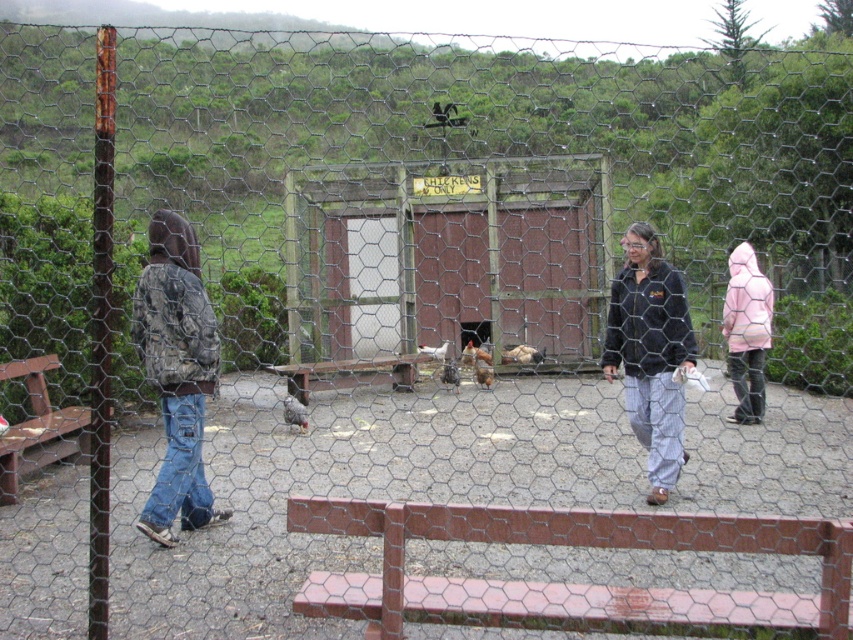
You are a farmer checking the chickens. You need to know if the pink matte jacket at right can fit through a gate that is the same width as the white matte chicken at center. Can it?

The pink matte jacket at right is wider than the white matte chicken at center, so it cannot fit through the gate which is the same width as the white matte chicken at center.

You are standing at the point marked by the coordinates point (746, 332) in the image. Looking around, you see a chicken coop with a red door and a sign that says CHICKENS ONLY. Which direction should you walk to reach the chicken coop?

The point (746, 332) indicates the pink matte jacket at right. Since the chicken coop is located beyond the wire mesh fence in the foreground, you should walk towards the chicken coop by moving away from the fence and towards the structure with the red door and sign.

You are standing in the rural outdoor scene described. There is a gray fur cat at center. Can you reach the cat with a 10 meter long fishing rod?

The gray fur cat at center is 9.15 meters from viewer, so yes, the fishing rod can reach the cat since it is shorter than the rod length.